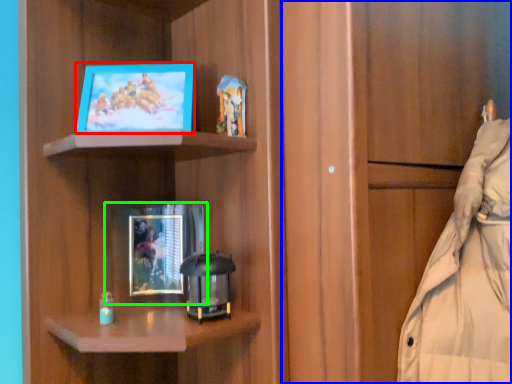
Question: Which object is positioned farthest from picture frame (highlighted by a red box)? Select from cabinetry (highlighted by a blue box) and picture frame (highlighted by a green box).

Choices:
 (A) cabinetry
 (B) picture frame

Answer: (A)